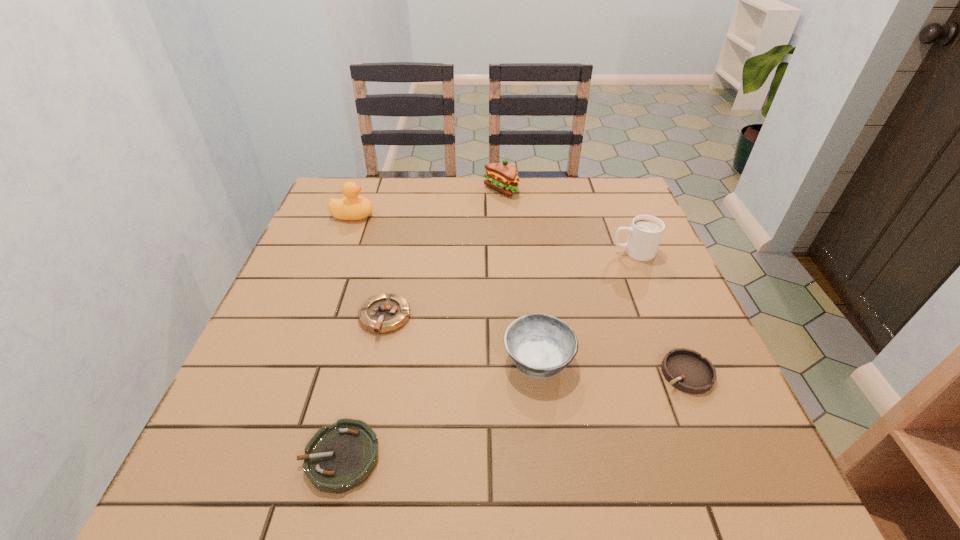
You are a GUI agent. You are given a task and a screenshot of the screen. Output one action in this format:
    pyautogui.click(x=<x>, y=<y>)
    Task: Click on the vacant space situated 0.250m on the left of the farthest object
    The image size is (960, 540).
    Given the screenshot: What is the action you would take?
    pyautogui.click(x=401, y=190)

Find the location of a particular element. Image resolution: width=960 pixels, height=540 pixels. free space located 0.070m on the face of the duck is located at coordinates (397, 215).

In order to click on free location located 0.050m on the side with the handle of the third tallest object in this screenshot , I will do `click(591, 252)`.

Locate an element on the screen. The image size is (960, 540). vacant space situated 0.200m on the side with the handle of the third tallest object is located at coordinates (533, 252).

Locate an element on the screen. The height and width of the screenshot is (540, 960). vacant space located on the side with the handle of the third tallest object is located at coordinates (580, 252).

Locate an element on the screen. free spot located 0.140m on the right of the third ashtray from left to right is located at coordinates (644, 360).

Locate an element on the screen. free location located on the left of the rightmost ashtray is located at coordinates (588, 373).

Where is `vacant space situated 0.150m on the right of the shortest ashtray`? The image size is (960, 540). vacant space situated 0.150m on the right of the shortest ashtray is located at coordinates (470, 457).

In order to click on sandwich that is at the far edge in this screenshot , I will do `click(502, 177)`.

Where is `duck that is at the far edge`? Image resolution: width=960 pixels, height=540 pixels. duck that is at the far edge is located at coordinates (353, 207).